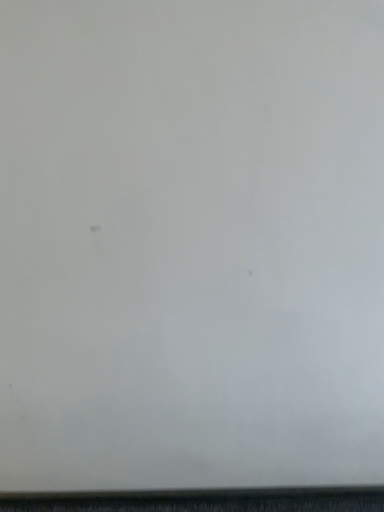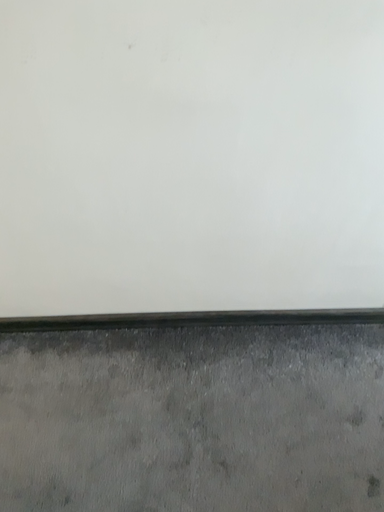
Question: Which way did the camera rotate in the video?

Choices:
 (A) rotated upward
 (B) rotated downward

Answer: (B)